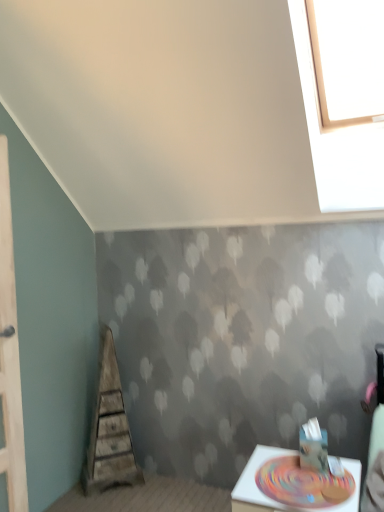
Find the location of a particular element. The width and height of the screenshot is (384, 512). free point above white glossy table at lower right (from a real-world perspective) is located at coordinates (307, 473).